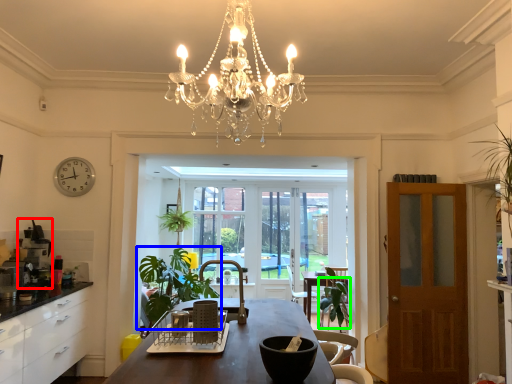
Question: Which is farther away from coffee machine (highlighted by a red box)? houseplant (highlighted by a blue box) or armchair (highlighted by a green box)?

Choices:
 (A) houseplant
 (B) armchair

Answer: (B)